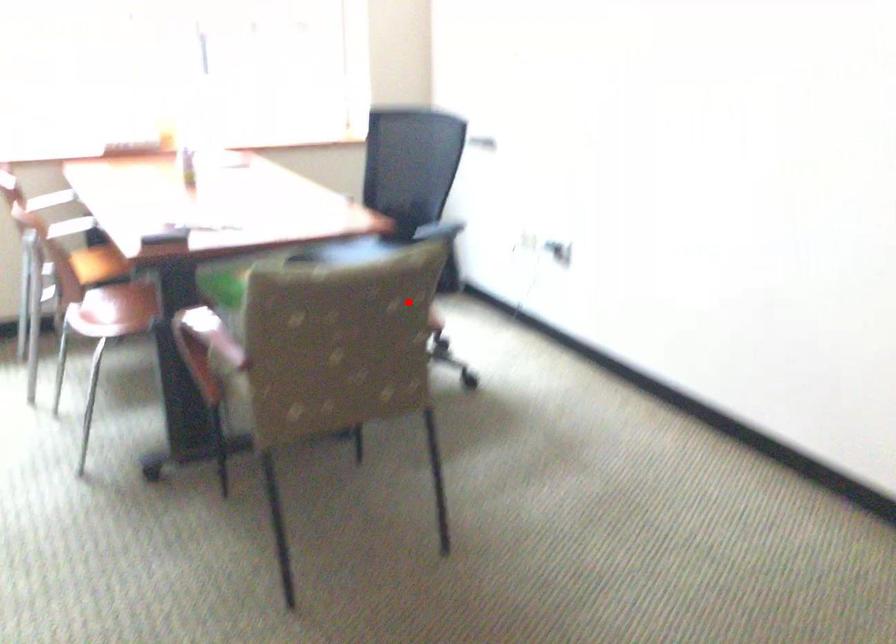
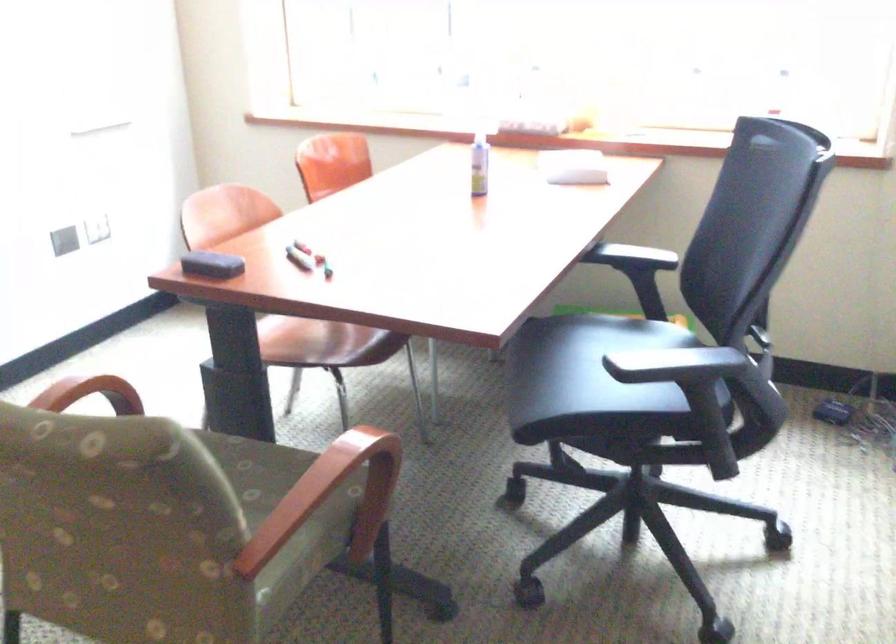
Question: I am providing you with two images of the same scene from different viewpoints. Image1 has a red point marked. In image2, the corresponding 3D location appears at what relative position? Reply with the corresponding letter.

Choices:
 (A) Closer
 (B) Farther

Answer: (A)